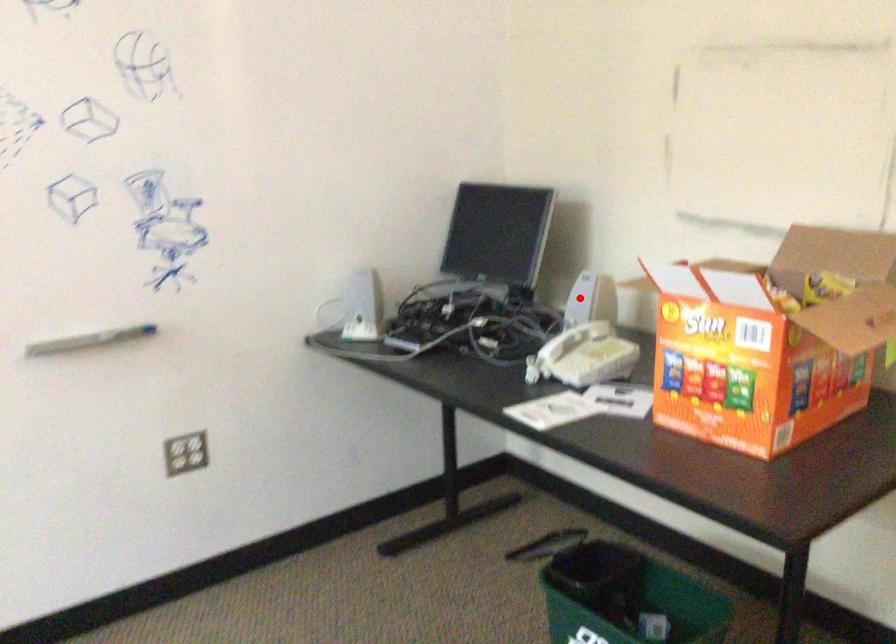
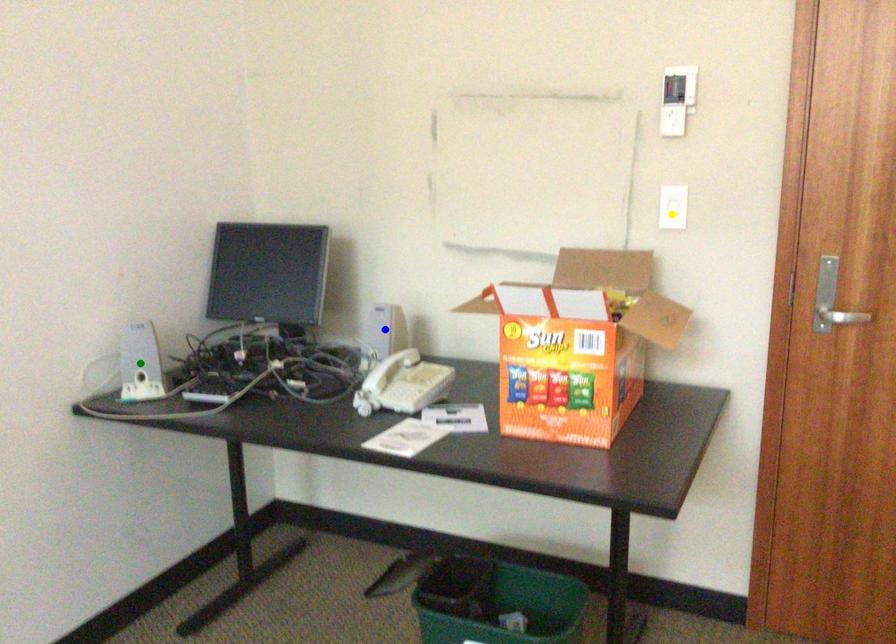
Question: I am providing you with two images of the same scene from different viewpoints. A red point is marked on the first image. You are given multiple points on the second image. Which spot in image 2 lines up with the point in image 1?

Choices:
 (A) blue point
 (B) yellow point
 (C) green point

Answer: (A)